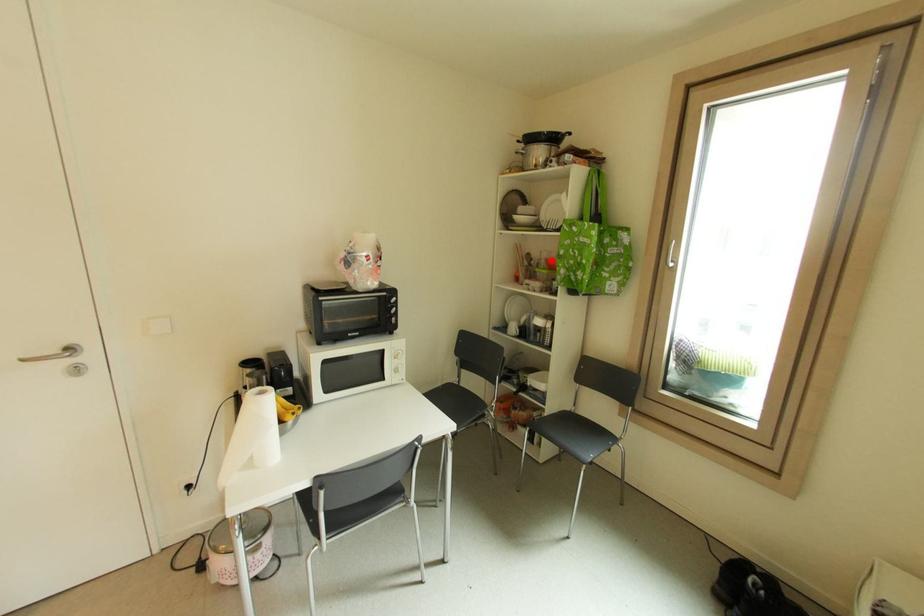
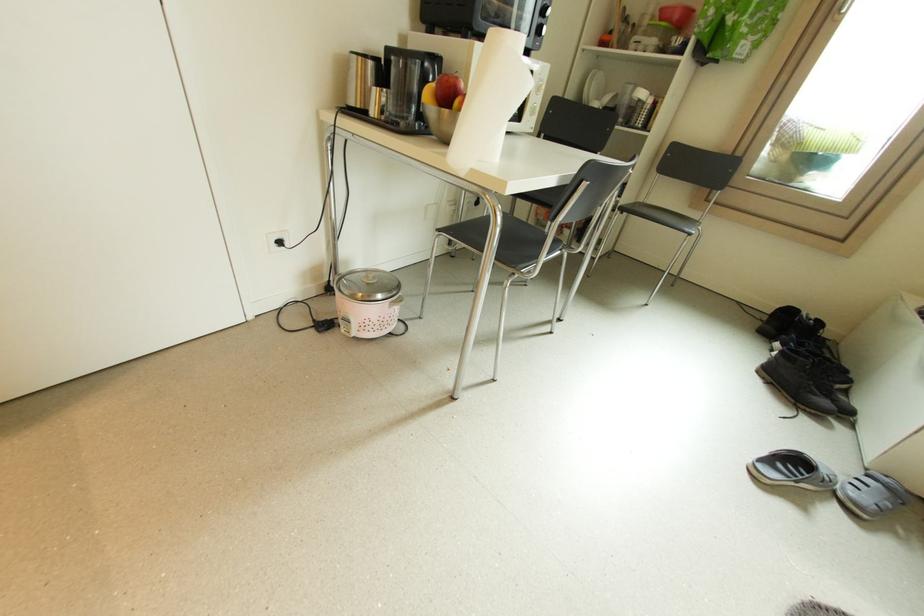
Question: I am providing you with two images of the same scene from different viewpoints. Image1 has a red point marked. In image2, the corresponding 3D location appears at what relative position? Reply with the corresponding letter.

Choices:
 (A) Closer
 (B) Farther

Answer: (B)